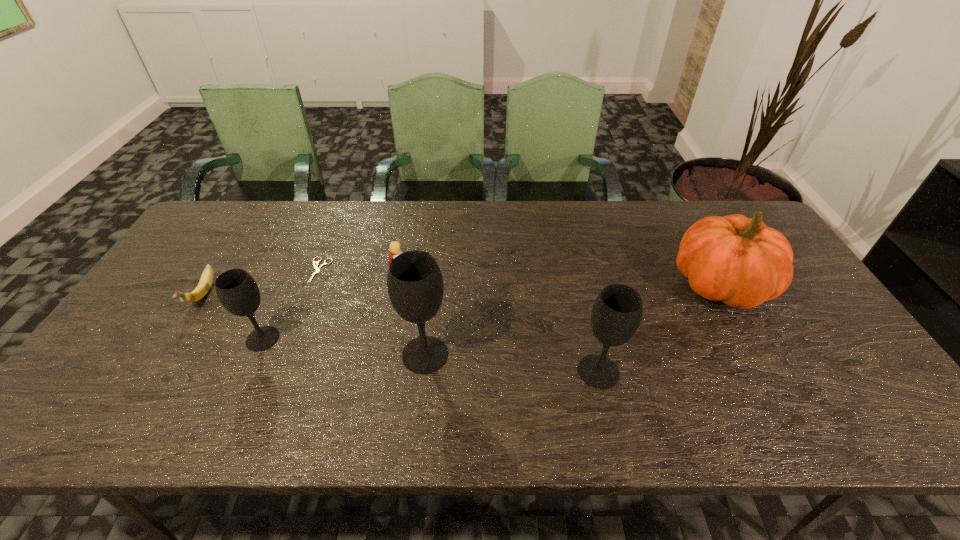
Please show where to add a wineglass on the right while keeping spacing even. Please provide its 2D coordinates. Your answer should be formatted as a tuple, i.e. [(x, y)], where the tuple contains the x and y coordinates of a point satisfying the conditions above.

[(784, 390)]